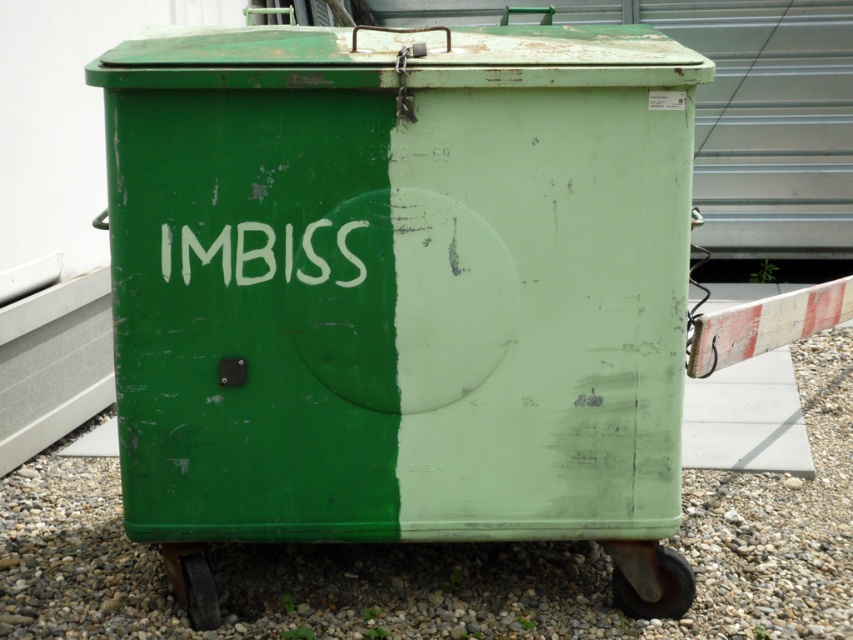
From the picture: You are standing in front of the green IMBISS container and notice two points marked on its surface. Which point is closer to you, point (392, 608) or point (364, 275)?

Point (392, 608) is closer to you because it is further to the viewer than point (364, 275).

You are a delivery person who needs to place a heavy box on the ground near the green container. The box must be placed on a stable surface. Which area should you choose between the green gravel at lower center and the white painted text at center?

The white painted text at center is a better choice because the green gravel at lower center is positioned under it, and the gravel is described as uneven and scattered with small stones and pebbles, making it unstable. The text area is likely on the container itself or a more solid part of the ground.